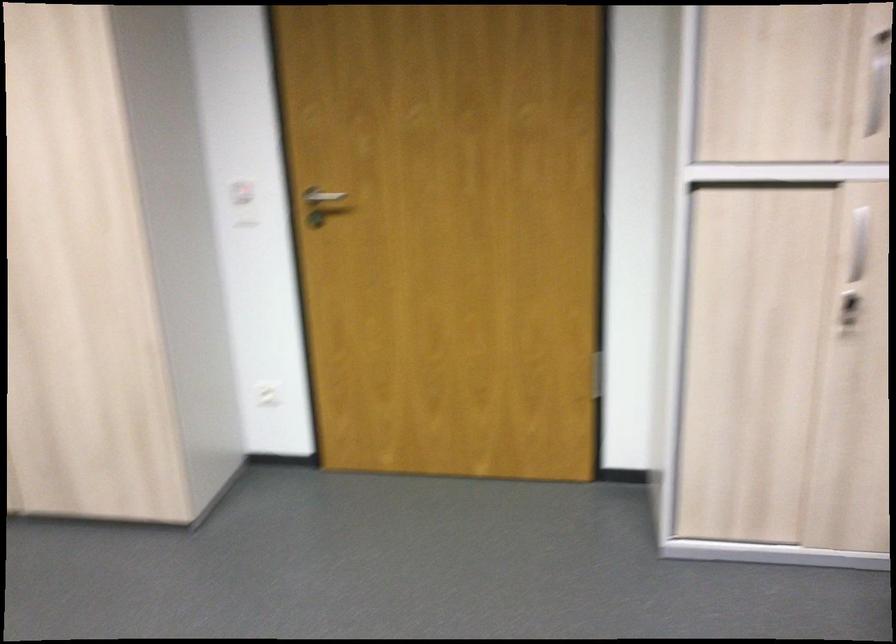
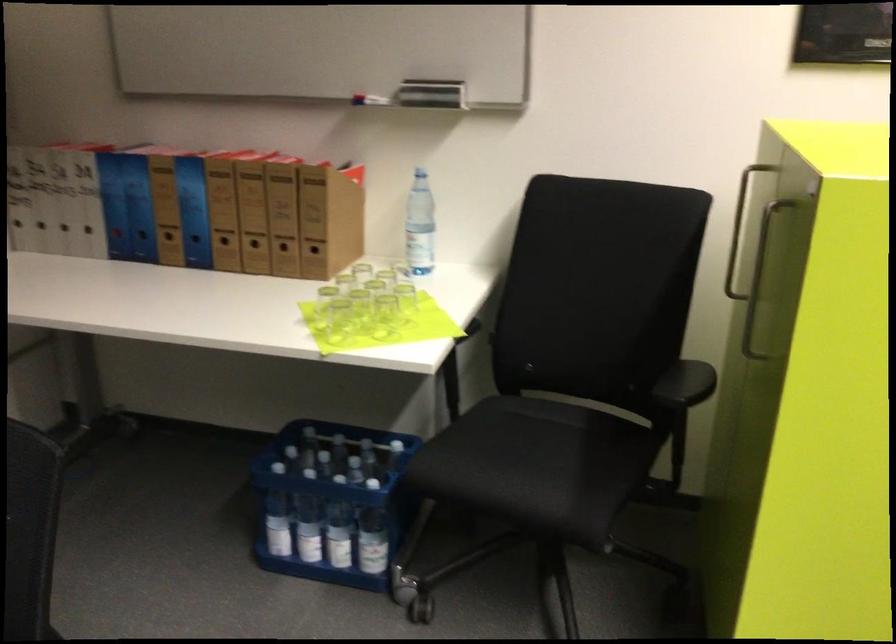
How did the camera likely rotate?

The camera's rotation is toward left-down.